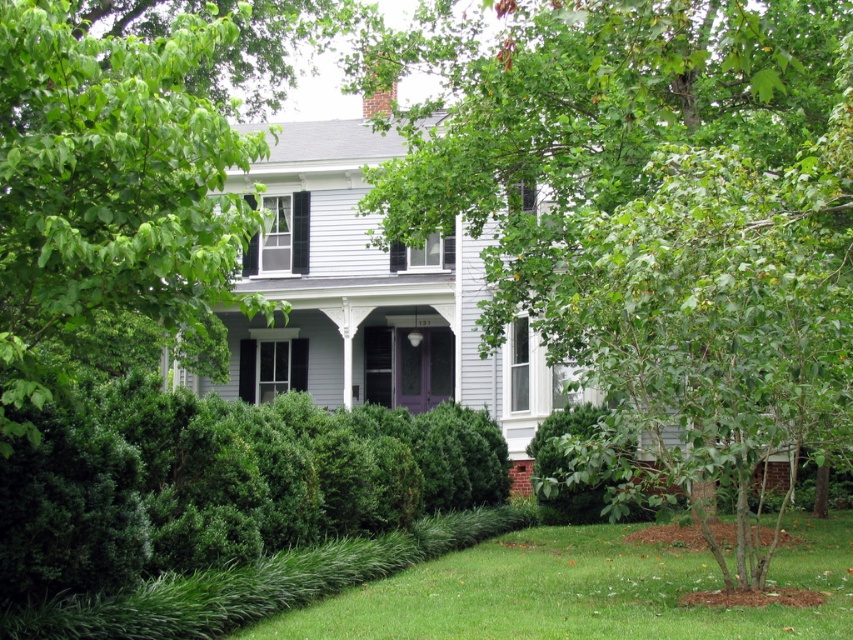
Question: Can you confirm if green bushy hedge at lower center is smaller than green grass at lower center?

Choices:
 (A) yes
 (B) no

Answer: (B)

Question: Does green bushy hedge at lower center have a lesser width compared to green grass at lower center?

Choices:
 (A) no
 (B) yes

Answer: (B)

Question: Which object is positioned closest to the green grass at lower center?

Choices:
 (A) green leafy tree at left
 (B) green bushy hedge at lower center
 (C) green leafy hedge at lower center
 (D) green leafy tree at center

Answer: (B)

Question: Which point is farther to the camera?

Choices:
 (A) green grass at lower center
 (B) green leafy hedge at lower center
 (C) green bushy hedge at lower center
 (D) green leafy tree at center

Answer: (B)

Question: Which object appears closest to the camera in this image?

Choices:
 (A) green leafy hedge at lower center
 (B) green grass at lower center
 (C) green bushy hedge at lower center
 (D) green leafy tree at center

Answer: (C)

Question: Is green leafy tree at center wider than green bushy hedge at lower center?

Choices:
 (A) yes
 (B) no

Answer: (A)